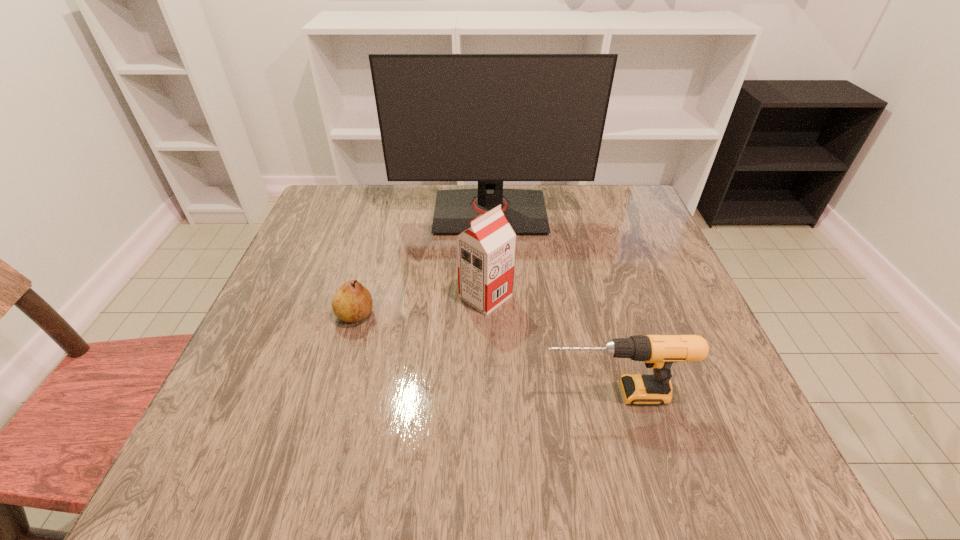
In order to click on vacant space at the near left corner in this screenshot , I will do coord(229,441).

In the image, there is a desktop. Where is `vacant space at the far right corner`? The image size is (960, 540). vacant space at the far right corner is located at coordinates (590, 185).

Where is `vacant space at the near right corner of the desktop`? Image resolution: width=960 pixels, height=540 pixels. vacant space at the near right corner of the desktop is located at coordinates (728, 482).

Find the location of `free space between the second tallest object and the third tallest object`. free space between the second tallest object and the third tallest object is located at coordinates (549, 345).

At what (x,y) coordinates should I click in order to perform the action: click on empty location between the soya milk and the nearest object. Please return your answer as a coordinate pair (x, y). This screenshot has height=540, width=960. Looking at the image, I should click on (549, 345).

Locate an element on the screen. The height and width of the screenshot is (540, 960). free point between the tallest object and the drill is located at coordinates (551, 303).

Identify the location of free space between the nearest object and the soya milk. Image resolution: width=960 pixels, height=540 pixels. (549, 345).

Image resolution: width=960 pixels, height=540 pixels. What are the coordinates of `free space between the monitor and the nearest object` in the screenshot? It's located at (551, 303).

The height and width of the screenshot is (540, 960). I want to click on free spot between the farthest object and the drill, so click(x=551, y=303).

This screenshot has width=960, height=540. I want to click on empty location between the third shortest object and the second shortest object, so click(549, 345).